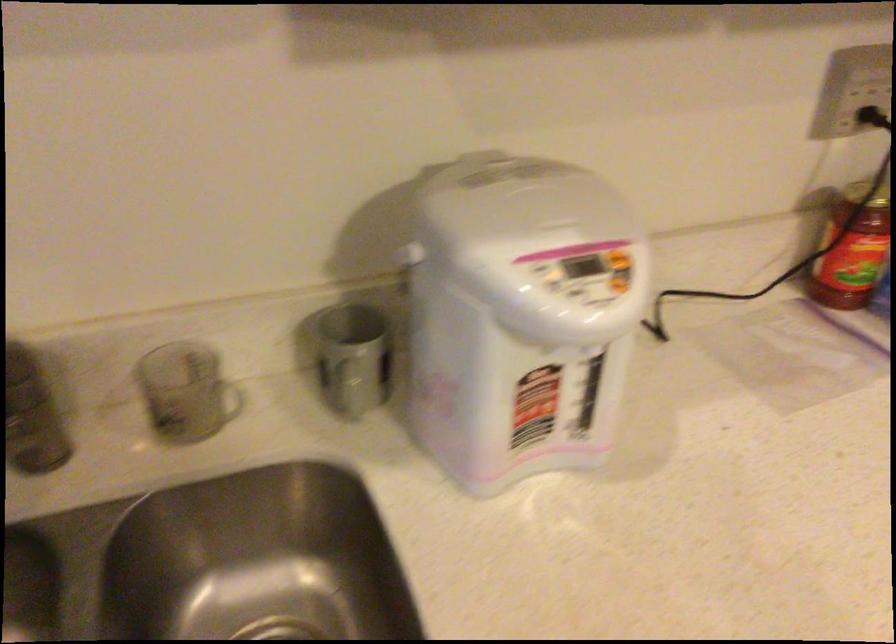
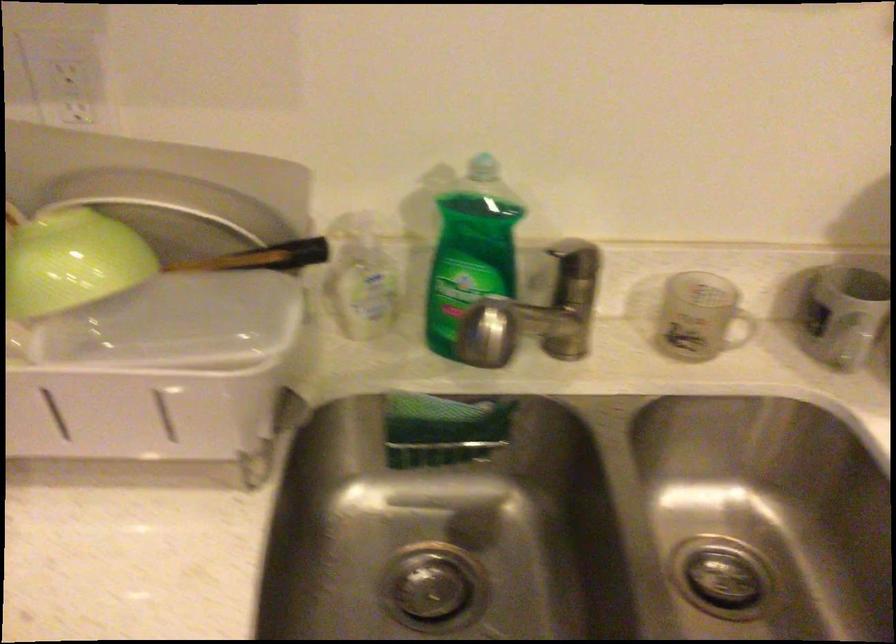
In the second image, find the point that corresponds to [256,393] in the first image.

(739, 328)